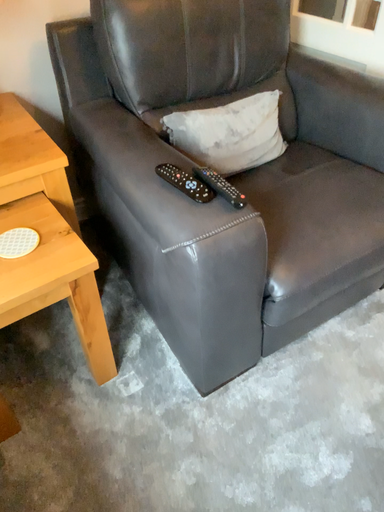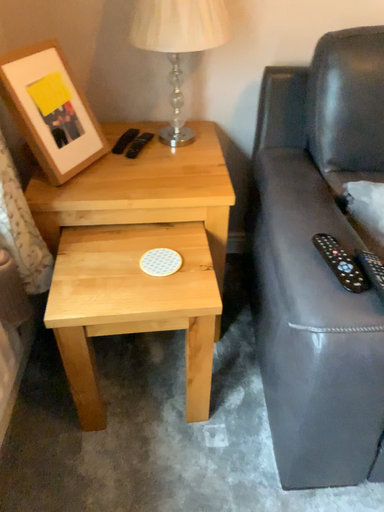
Question: Which way did the camera rotate in the video?

Choices:
 (A) rotated upward
 (B) rotated downward

Answer: (A)